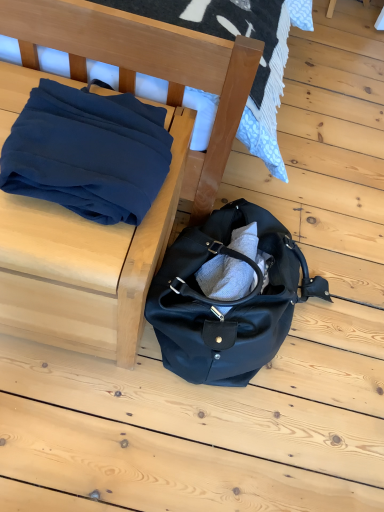
What do you see at coordinates (168, 174) in the screenshot? I see `matte blue fabric at left` at bounding box center [168, 174].

At what (x,y) coordinates should I click in order to perform the action: click on matte blue fabric at left. Please return your answer as a coordinate pair (x, y). Looking at the image, I should click on (168, 174).

Image resolution: width=384 pixels, height=512 pixels. Find the location of `matte blue fabric at left`. matte blue fabric at left is located at coordinates (168, 174).

From the image's perspective, which one is positioned higher, matte black duffel bag at lower center or matte blue fabric at left?

matte blue fabric at left is shown above in the image.

Considering the relative positions of matte black duffel bag at lower center and matte blue fabric at left in the image provided, is matte black duffel bag at lower center to the left of matte blue fabric at left from the viewer's perspective?

Incorrect, matte black duffel bag at lower center is not on the left side of matte blue fabric at left.

Considering the relative sizes of matte black duffel bag at lower center and matte blue fabric at left in the image provided, is matte black duffel bag at lower center thinner than matte blue fabric at left?

No, matte black duffel bag at lower center is not thinner than matte blue fabric at left.

From a real-world perspective, is navy blue fabric at upper left under matte blue fabric at left?

No.

Would you consider navy blue fabric at upper left to be distant from matte blue fabric at left?

navy blue fabric at upper left is near matte blue fabric at left, not far away.

What's the angular difference between navy blue fabric at upper left and matte blue fabric at left's facing directions?

The angle between the facing direction of navy blue fabric at upper left and the facing direction of matte blue fabric at left is 0.000328 degrees.

Is point (31, 109) positioned behind point (217, 49)?

No, (31, 109) is in front of (217, 49).

Looking at the image, does matte blue fabric at left seem bigger or smaller compared to matte black duffel bag at lower center?

In the image, matte blue fabric at left appears to be larger than matte black duffel bag at lower center.

Which is more to the left, matte blue fabric at left or matte black duffel bag at lower center?

matte blue fabric at left.

Which is nearer, (124, 34) or (211, 324)?

Clearly, point (124, 34) is closer to the camera than point (211, 324).

In terms of height, does navy blue fabric at upper left look taller or shorter compared to matte black duffel bag at lower center?

In the image, navy blue fabric at upper left appears to be shorter than matte black duffel bag at lower center.

From the image's perspective, between navy blue fabric at upper left and matte black duffel bag at lower center, which one is located above?

navy blue fabric at upper left.

Based on the photo, does navy blue fabric at upper left contain matte black duffel bag at lower center?

Actually, matte black duffel bag at lower center is outside navy blue fabric at upper left.

Considering the positions of points (55, 142) and (207, 379), is point (55, 142) farther from camera compared to point (207, 379)?

No, (55, 142) is closer to viewer.

Does point (205, 42) come closer to viewer compared to point (89, 177)?

No.

Does matte blue fabric at left have a larger size compared to navy blue fabric at upper left?

Correct, matte blue fabric at left is larger in size than navy blue fabric at upper left.

Is matte blue fabric at left oriented away from navy blue fabric at upper left?

matte blue fabric at left is not turned away from navy blue fabric at upper left.

From the picture: Is matte black duffel bag at lower center wider than navy blue fabric at upper left?

Yes, matte black duffel bag at lower center is wider than navy blue fabric at upper left.

Is matte black duffel bag at lower center next to navy blue fabric at upper left?

matte black duffel bag at lower center and navy blue fabric at upper left are clearly separated.

From a real-world perspective, is matte black duffel bag at lower center physically located above or below navy blue fabric at upper left?

From a real-world perspective, matte black duffel bag at lower center is physically below navy blue fabric at upper left.

Where is `handbag below the matte blue fabric at left (from the image's perspective)`? handbag below the matte blue fabric at left (from the image's perspective) is located at coordinates (233, 306).

What are the coordinates of `furniture located underneath the navy blue fabric at upper left (from a real-world perspective)` in the screenshot? It's located at (168, 174).

When comparing their distances from matte blue fabric at left, does matte black duffel bag at lower center or navy blue fabric at upper left seem closer?

The object closer to matte blue fabric at left is navy blue fabric at upper left.

Looking at the image, which one is located further to matte blue fabric at left, navy blue fabric at upper left or matte black duffel bag at lower center?

The object further to matte blue fabric at left is matte black duffel bag at lower center.

Consider the image. Estimate the real-world distances between objects in this image. Which object is further from matte black duffel bag at lower center, navy blue fabric at upper left or matte blue fabric at left?

navy blue fabric at upper left.

Which object lies nearer to the anchor point matte black duffel bag at lower center, matte blue fabric at left or navy blue fabric at upper left?

matte blue fabric at left is closer to matte black duffel bag at lower center.

Based on their spatial positions, is matte blue fabric at left or matte black duffel bag at lower center closer to navy blue fabric at upper left?

The object closer to navy blue fabric at upper left is matte blue fabric at left.

Looking at the image, which one is located closer to navy blue fabric at upper left, matte black duffel bag at lower center or matte blue fabric at left?

Among the two, matte blue fabric at left is located nearer to navy blue fabric at upper left.

Image resolution: width=384 pixels, height=512 pixels. In order to click on blanket located between matte blue fabric at left and matte black duffel bag at lower center in the left-right direction in this screenshot , I will do `click(85, 154)`.